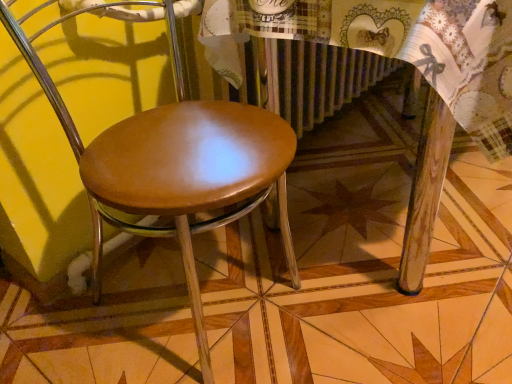
Where is `vacant space underneath wooden table at center (from a real-world perspective)`? vacant space underneath wooden table at center (from a real-world perspective) is located at coordinates (384, 192).